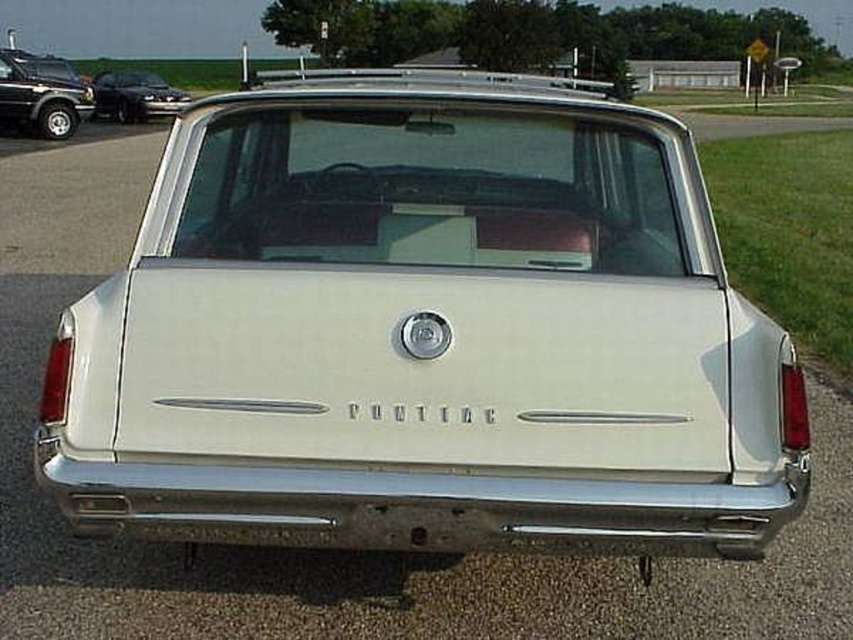
Question: Which point is closer to the camera taking this photo?

Choices:
 (A) (62, 115)
 (B) (173, 275)
 (C) (123, 72)

Answer: (B)

Question: Does white matte station wagon at center appear on the right side of shiny black sedan at left?

Choices:
 (A) yes
 (B) no

Answer: (A)

Question: Can you confirm if white matte station wagon at center is positioned below shiny black sedan at left?

Choices:
 (A) yes
 (B) no

Answer: (A)

Question: Based on their relative distances, which object is nearer to the matte black suv at upper left?

Choices:
 (A) white matte station wagon at center
 (B) shiny black sedan at left

Answer: (B)

Question: Can you confirm if white matte station wagon at center is positioned above matte black suv at upper left?

Choices:
 (A) no
 (B) yes

Answer: (A)

Question: Which point is farther to the camera?

Choices:
 (A) (13, 100)
 (B) (409, 444)

Answer: (A)